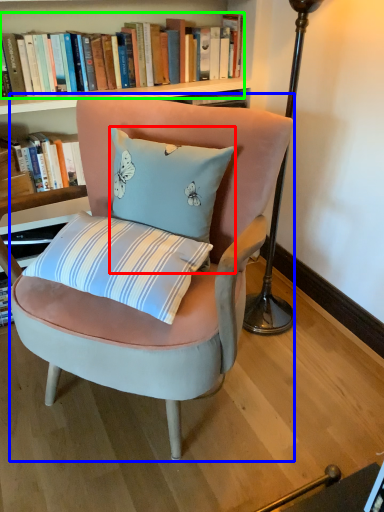
Question: Which object is positioned closest to pillow (highlighted by a red box)? Select from chair (highlighted by a blue box) and book (highlighted by a green box).

Choices:
 (A) chair
 (B) book

Answer: (A)